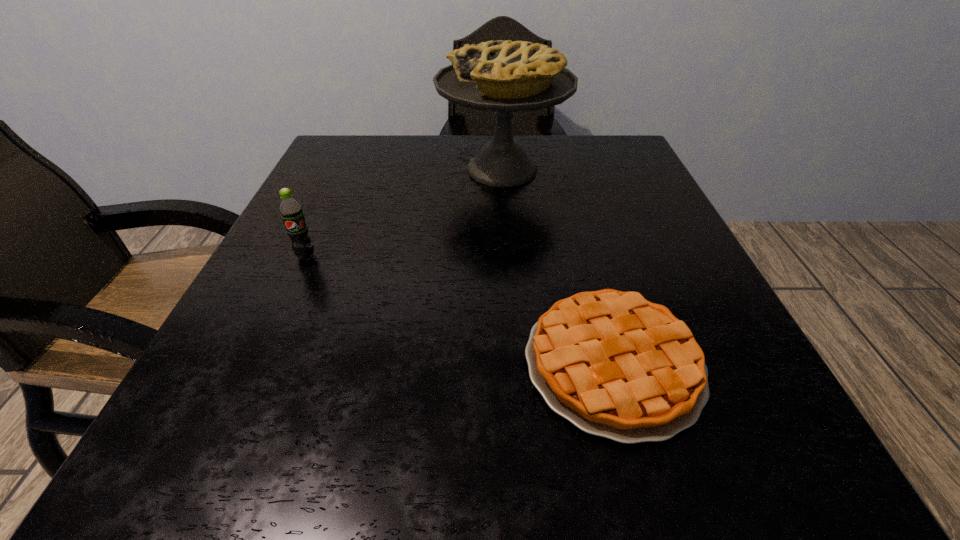
I want to click on object that is the second closest to the farther pie, so click(615, 365).

Select which object appears as the second closest to the leftmost object. Please provide its 2D coordinates. Your answer should be formatted as a tuple, i.e. [(x, y)], where the tuple contains the x and y coordinates of a point satisfying the conditions above.

[(615, 365)]

I want to click on vacant space that satisfies the following two spatial constraints: 1. on the front label of the shortest object; 2. on the left side of the leftmost object, so click(x=256, y=364).

Identify the location of vacant position in the image that satisfies the following two spatial constraints: 1. on the front label of the second nearest object; 2. on the right side of the shortest object. (256, 364).

Identify the location of free spot that satisfies the following two spatial constraints: 1. on the cut side of the farther pie; 2. on the right side of the nearest object. (517, 364).

I want to click on free space that satisfies the following two spatial constraints: 1. on the cut side of the farther pie; 2. on the left side of the nearest object, so [x=517, y=364].

Where is `free space that satisfies the following two spatial constraints: 1. on the cut side of the tallest object; 2. on the front label of the second shortest object`? free space that satisfies the following two spatial constraints: 1. on the cut side of the tallest object; 2. on the front label of the second shortest object is located at coordinates (509, 256).

The height and width of the screenshot is (540, 960). I want to click on vacant region that satisfies the following two spatial constraints: 1. on the cut side of the tallest object; 2. on the right side of the nearer pie, so click(517, 364).

At what (x,y) coordinates should I click in order to perform the action: click on vacant area in the image that satisfies the following two spatial constraints: 1. on the cut side of the farther pie; 2. on the front label of the soda. Please return your answer as a coordinate pair (x, y). The image size is (960, 540). Looking at the image, I should click on (509, 256).

I want to click on free location that satisfies the following two spatial constraints: 1. on the back side of the shorter pie; 2. on the cut side of the farthest object, so click(x=560, y=170).